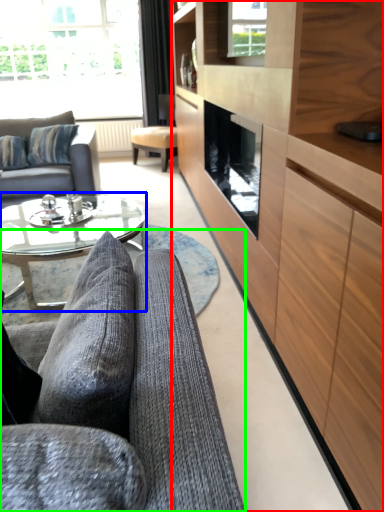
Question: Which is farther away from cabinetry (highlighted by a red box)? coffee table (highlighted by a blue box) or studio couch (highlighted by a green box)?

Choices:
 (A) coffee table
 (B) studio couch

Answer: (A)